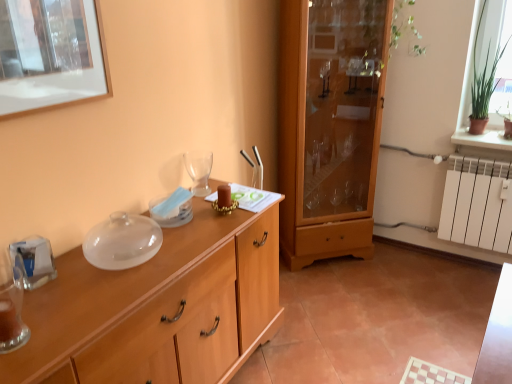
Question: Is translucent glass vase at left bigger or smaller than transparent glass wine glass at center?

Choices:
 (A) big
 (B) small

Answer: (B)

Question: Is translucent glass vase at left inside or outside of transparent glass wine glass at center?

Choices:
 (A) outside
 (B) inside

Answer: (A)

Question: Which object is positioned farthest from the wooden cabinet at center?

Choices:
 (A) wooden picture frame at upper left
 (B) wooden cabinet at center
 (C) translucent glass vase at left
 (D) transparent glass wine glass at center

Answer: (B)

Question: Estimate the real-world distances between objects in this image. Which object is farther from the translucent glass vase at left?

Choices:
 (A) wooden picture frame at upper left
 (B) transparent glass wine glass at center
 (C) wooden cabinet at center
 (D) wooden cabinet at center

Answer: (C)